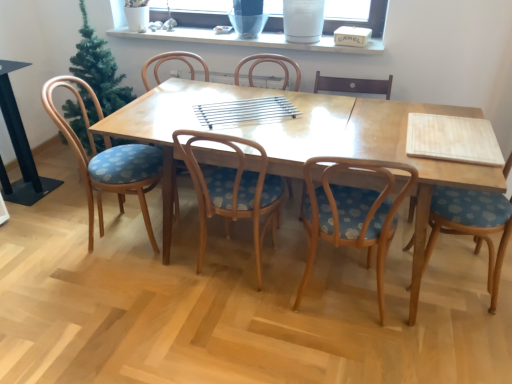
Identify the location of vacant area that lies between wooden chair with blue floral cushion at center, acting as the 5th chair starting from the left, and wooden chair with blue cushion at center, which is counted as the 4th chair, starting from the right. (288, 294).